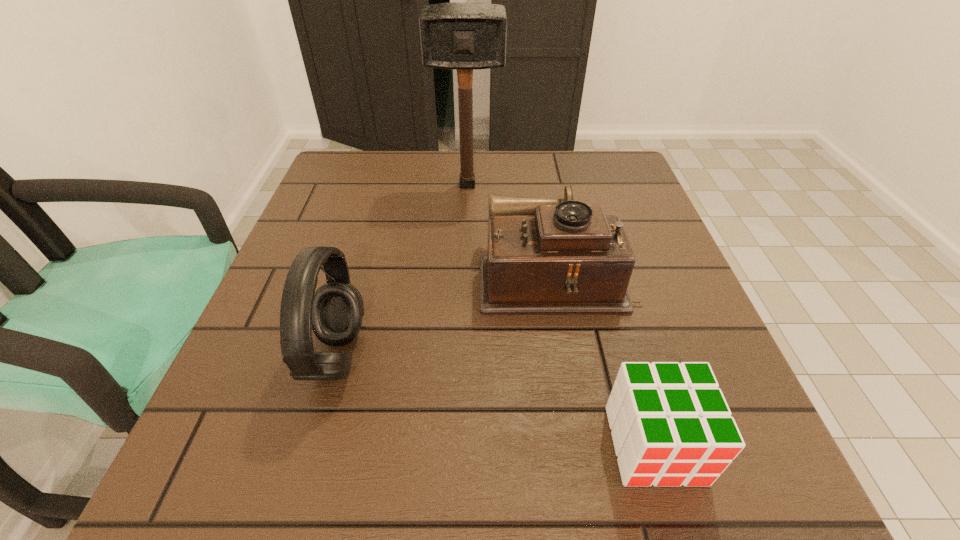
At what (x,y) coordinates should I click in order to perform the action: click on mallet. Please return your answer as a coordinate pair (x, y). The height and width of the screenshot is (540, 960). Looking at the image, I should click on (456, 36).

At what (x,y) coordinates should I click in order to perform the action: click on the tallest object. Please return your answer as a coordinate pair (x, y). This screenshot has width=960, height=540. Looking at the image, I should click on (456, 36).

You are a GUI agent. You are given a task and a screenshot of the screen. Output one action in this format:
    pyautogui.click(x=<x>, y=<y>)
    Task: Click on the leftmost object
    This screenshot has height=540, width=960.
    Given the screenshot: What is the action you would take?
    pyautogui.click(x=335, y=311)

Identify the location of the third shortest object. (335, 311).

At what (x,y) coordinates should I click in order to perform the action: click on phonograph_record. Please return your answer as a coordinate pair (x, y). The image size is (960, 540). Looking at the image, I should click on (545, 256).

Locate an element on the screen. This screenshot has height=540, width=960. cube is located at coordinates (671, 425).

Identify the location of free space located 0.290m on the front of the mallet. The height and width of the screenshot is (540, 960). (464, 280).

Where is `free space located 0.160m on the earcups of the second tallest object`? free space located 0.160m on the earcups of the second tallest object is located at coordinates coord(459,356).

Identify the location of free space located 0.250m on the horn of the phonograph_record. Image resolution: width=960 pixels, height=540 pixels. (352, 274).

Locate an element on the screen. This screenshot has width=960, height=540. vacant space located on the horn of the phonograph_record is located at coordinates (383, 274).